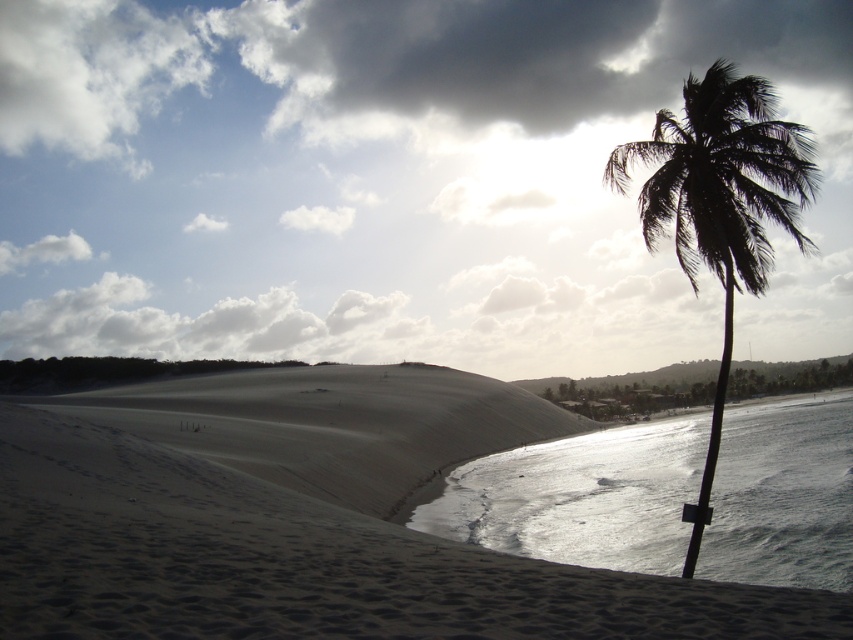
Who is lower down, glistening silver water at beach right or silhouette leafy palm at right?

Positioned lower is glistening silver water at beach right.

At what (x,y) coordinates should I click in order to perform the action: click on glistening silver water at beach right. Please return your answer as a coordinate pair (x, y). This screenshot has height=640, width=853. Looking at the image, I should click on (579, 497).

Between sandy at lower left and silhouette leafy palm at right, which one appears on the right side from the viewer's perspective?

Positioned to the right is silhouette leafy palm at right.

Based on the photo, does sandy at lower left have a lesser height compared to silhouette leafy palm at right?

Yes, sandy at lower left is shorter than silhouette leafy palm at right.

Who is more forward, (283, 524) or (671, 170)?

Point (283, 524)

This screenshot has height=640, width=853. Identify the location of sandy at lower left. (300, 561).

Who is positioned more to the right, glistening silver water at beach right or sandy beige dune at center?

glistening silver water at beach right is more to the right.

Measure the distance between glistening silver water at beach right and sandy beige dune at center.

A distance of 11.67 meters exists between glistening silver water at beach right and sandy beige dune at center.

Is point (503, 506) in front of point (251, 406)?

That is True.

This screenshot has width=853, height=640. In order to click on glistening silver water at beach right in this screenshot , I will do `click(579, 497)`.